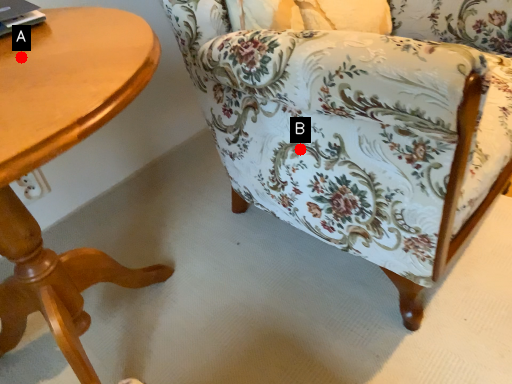
Question: Two points are circled on the image, labeled by A and B beside each circle. Which point is closer to the camera taking this photo?

Choices:
 (A) A is closer
 (B) B is closer

Answer: (A)